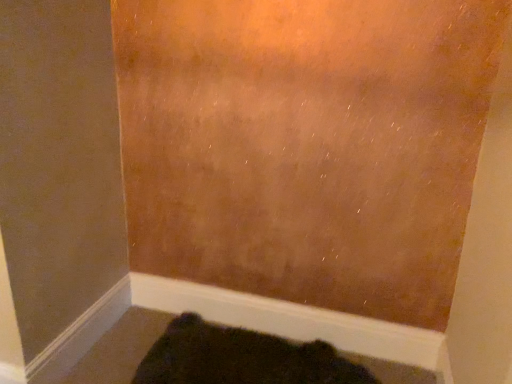
What is the approximate width of dark fuzzy rug at lower center?

52.83 centimeters.

What do you see at coordinates (241, 358) in the screenshot? I see `dark fuzzy rug at lower center` at bounding box center [241, 358].

You are a GUI agent. You are given a task and a screenshot of the screen. Output one action in this format:
    pyautogui.click(x=<x>, y=<y>)
    Task: Click on the dark fuzzy rug at lower center
    The height and width of the screenshot is (384, 512).
    Given the screenshot: What is the action you would take?
    pyautogui.click(x=241, y=358)

What is the approximate height of white smooth baseboard at lower center?

The height of white smooth baseboard at lower center is 6.33 inches.

At what (x,y) coordinates should I click in order to perform the action: click on white smooth baseboard at lower center. Please return your answer as a coordinate pair (x, y). The height and width of the screenshot is (384, 512). Looking at the image, I should click on (293, 321).

Describe the element at coordinates (293, 321) in the screenshot. I see `white smooth baseboard at lower center` at that location.

Where is `dark fuzzy rug at lower center`? The image size is (512, 384). dark fuzzy rug at lower center is located at coordinates (241, 358).

Can you confirm if white smooth baseboard at lower center is positioned to the right of dark fuzzy rug at lower center?

Yes.

In the image, is white smooth baseboard at lower center positioned in front of or behind dark fuzzy rug at lower center?

Visually, white smooth baseboard at lower center is located behind dark fuzzy rug at lower center.

Considering the points (362, 317) and (325, 371), which point is behind, point (362, 317) or point (325, 371)?

The point (362, 317) is farther from the camera.

Based on the photo, from the image's perspective, between white smooth baseboard at lower center and dark fuzzy rug at lower center, which one is located above?

From the image's view, white smooth baseboard at lower center is above.

From a real-world perspective, is white smooth baseboard at lower center beneath dark fuzzy rug at lower center?

Actually, white smooth baseboard at lower center is physically above dark fuzzy rug at lower center in the real world.

In terms of width, does white smooth baseboard at lower center look wider or thinner when compared to dark fuzzy rug at lower center?

white smooth baseboard at lower center is thinner than dark fuzzy rug at lower center.

Is white smooth baseboard at lower center taller than dark fuzzy rug at lower center?

Indeed, white smooth baseboard at lower center has a greater height compared to dark fuzzy rug at lower center.

In terms of size, does white smooth baseboard at lower center appear bigger or smaller than dark fuzzy rug at lower center?

Clearly, white smooth baseboard at lower center is smaller in size than dark fuzzy rug at lower center.

Does white smooth baseboard at lower center contain dark fuzzy rug at lower center?

That's incorrect, dark fuzzy rug at lower center is not inside white smooth baseboard at lower center.

Is the surface of white smooth baseboard at lower center in direct contact with dark fuzzy rug at lower center?

No, white smooth baseboard at lower center is not with dark fuzzy rug at lower center.

Is white smooth baseboard at lower center turned away from dark fuzzy rug at lower center?

Yes, white smooth baseboard at lower center's orientation is away from dark fuzzy rug at lower center.

What's the angular difference between white smooth baseboard at lower center and dark fuzzy rug at lower center's facing directions?

The angle between the facing direction of white smooth baseboard at lower center and the facing direction of dark fuzzy rug at lower center is 0.764 degrees.

How much distance is there between white smooth baseboard at lower center and dark fuzzy rug at lower center?

They are 7.83 inches apart.

Identify the location of animal below the white smooth baseboard at lower center (from a real-world perspective). The width and height of the screenshot is (512, 384). (241, 358).

Is dark fuzzy rug at lower center to the left of white smooth baseboard at lower center from the viewer's perspective?

Indeed, dark fuzzy rug at lower center is positioned on the left side of white smooth baseboard at lower center.

Which object is further away from the camera taking this photo, dark fuzzy rug at lower center or white smooth baseboard at lower center?

white smooth baseboard at lower center.

Between point (234, 338) and point (198, 299), which one is positioned in front?

The point (234, 338) is closer to the camera.

From the image's perspective, which is above, dark fuzzy rug at lower center or white smooth baseboard at lower center?

white smooth baseboard at lower center appears higher in the image.

From a real-world perspective, is dark fuzzy rug at lower center located higher than white smooth baseboard at lower center?

No, from a real-world perspective, dark fuzzy rug at lower center is not above white smooth baseboard at lower center.

Does dark fuzzy rug at lower center have a greater width compared to white smooth baseboard at lower center?

Yes, dark fuzzy rug at lower center is wider than white smooth baseboard at lower center.

Can you confirm if dark fuzzy rug at lower center is shorter than white smooth baseboard at lower center?

Correct, dark fuzzy rug at lower center is not as tall as white smooth baseboard at lower center.

Can you confirm if dark fuzzy rug at lower center is smaller than white smooth baseboard at lower center?

No.

Is dark fuzzy rug at lower center outside of white smooth baseboard at lower center?

Yes.

In the scene shown: Is dark fuzzy rug at lower center beside white smooth baseboard at lower center?

No.

Is dark fuzzy rug at lower center aimed at white smooth baseboard at lower center?

No, dark fuzzy rug at lower center does not turn towards white smooth baseboard at lower center.

What's the angular difference between dark fuzzy rug at lower center and white smooth baseboard at lower center's facing directions?

The facing directions of dark fuzzy rug at lower center and white smooth baseboard at lower center are 0.764 degrees apart.

Where is `animal that appears on the left of white smooth baseboard at lower center`? This screenshot has width=512, height=384. animal that appears on the left of white smooth baseboard at lower center is located at coordinates (241, 358).

Find the location of `animal below the white smooth baseboard at lower center (from a real-world perspective)`. animal below the white smooth baseboard at lower center (from a real-world perspective) is located at coordinates (241, 358).

Identify the location of molding located above the dark fuzzy rug at lower center (from a real-world perspective). (293, 321).